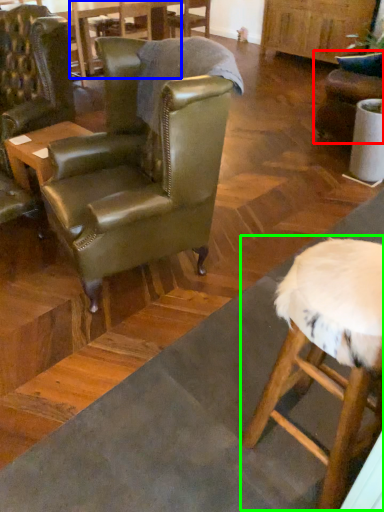
Question: Estimate the real-world distances between objects in this image. Which object is closer to chair (highlighted by a red box), table (highlighted by a blue box) or bar stool (highlighted by a green box)?

Choices:
 (A) table
 (B) bar stool

Answer: (A)